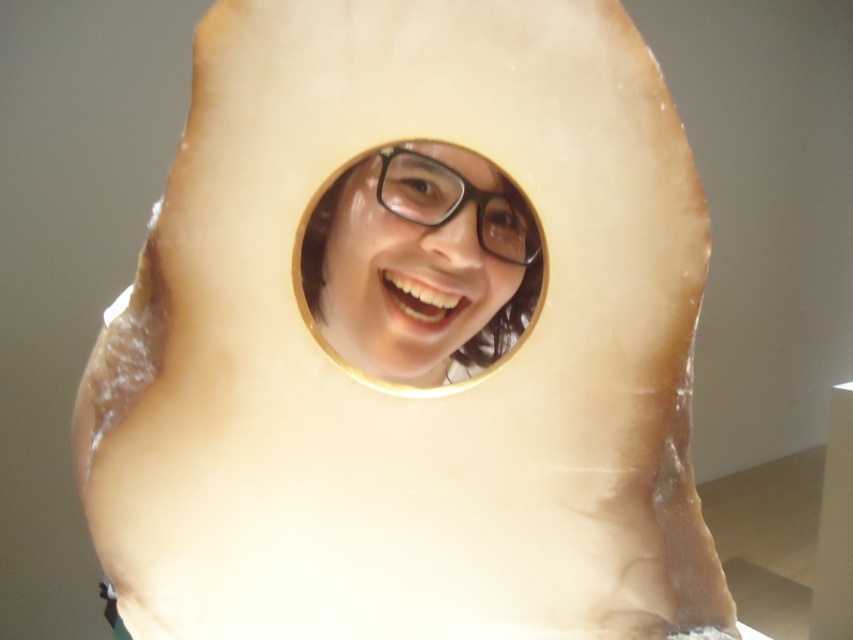
Question: Is matte black glasses at center above black plastic glasses at center?

Choices:
 (A) no
 (B) yes

Answer: (A)

Question: Is matte black glasses at center closer to camera compared to black plastic glasses at center?

Choices:
 (A) no
 (B) yes

Answer: (B)

Question: Can you confirm if matte black glasses at center is positioned to the right of black plastic glasses at center?

Choices:
 (A) no
 (B) yes

Answer: (A)

Question: Which point is closer to the camera?

Choices:
 (A) (442, 205)
 (B) (364, 284)

Answer: (B)